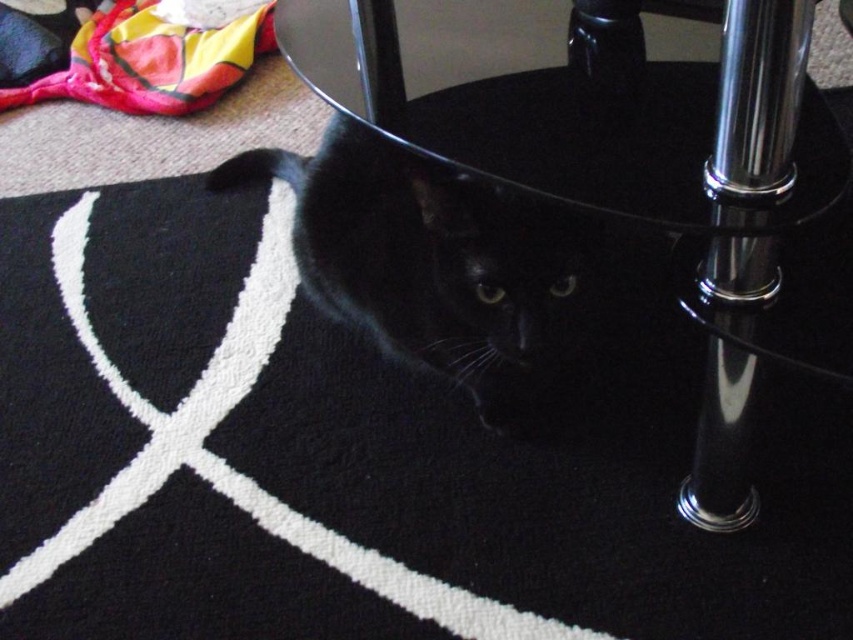
Can you confirm if transparent glass table at center is wider than black glossy cat at lower center?

Yes.

Is transparent glass table at center taller than black glossy cat at lower center?

Yes.

Is point (845, 364) more distant than point (490, 317)?

No, (845, 364) is in front of (490, 317).

I want to click on transparent glass table at center, so click(631, 160).